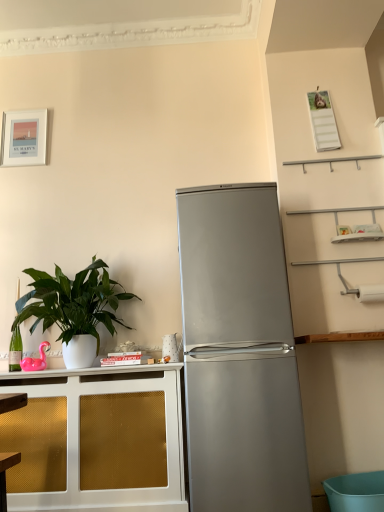
Question: Considering the positions of satin silver refrigerator at center and matte white picture frame at upper left in the image, is satin silver refrigerator at center taller or shorter than matte white picture frame at upper left?

Choices:
 (A) tall
 (B) short

Answer: (A)

Question: From the image's perspective, relative to matte white picture frame at upper left, is satin silver refrigerator at center above or below?

Choices:
 (A) above
 (B) below

Answer: (B)

Question: Which object is positioned closest to the silver metallic refrigerator at center?

Choices:
 (A) satin silver refrigerator at center
 (B) green glossy plant at left
 (C) matte white picture frame at upper left
 (D) gold mesh cabinet at left

Answer: (B)

Question: Considering the real-world distances, which object is closest to the satin silver refrigerator at center?

Choices:
 (A) silver metallic refrigerator at center
 (B) gold mesh cabinet at left
 (C) matte white picture frame at upper left
 (D) green glossy plant at left

Answer: (B)